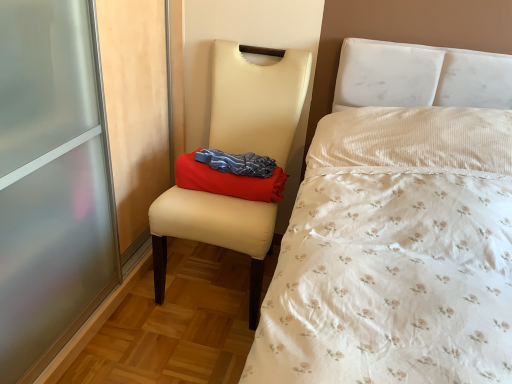
Find the location of a particular element. red fabric pillow at center is located at coordinates (231, 175).

This screenshot has height=384, width=512. What do you see at coordinates (231, 175) in the screenshot?
I see `red fabric pillow at center` at bounding box center [231, 175].

Describe the element at coordinates (256, 101) in the screenshot. I see `matte cream chair at center` at that location.

What are the coordinates of `matte cream chair at center` in the screenshot? It's located at (256, 101).

The height and width of the screenshot is (384, 512). Find the location of `red fabric pillow at center`. red fabric pillow at center is located at coordinates (231, 175).

Would you say red fabric pillow at center is to the left or to the right of matte cream chair at center in the picture?

Based on their positions, red fabric pillow at center is located to the right of matte cream chair at center.

From the picture: Which object is closer to the camera taking this photo, red fabric pillow at center or matte cream chair at center?

matte cream chair at center is in front.

Is point (193, 169) closer to viewer compared to point (212, 120)?

That is True.

From the image's perspective, is red fabric pillow at center positioned above or below matte cream chair at center?

Based on their image positions, red fabric pillow at center is located above matte cream chair at center.

From a real-world perspective, which is physically below, red fabric pillow at center or matte cream chair at center?

matte cream chair at center is physically lower.

Considering the relative sizes of red fabric pillow at center and matte cream chair at center in the image provided, is red fabric pillow at center thinner than matte cream chair at center?

Yes, red fabric pillow at center is thinner than matte cream chair at center.

In the scene shown: Between red fabric pillow at center and matte cream chair at center, which one has more height?

Standing taller between the two is matte cream chair at center.

Who is bigger, red fabric pillow at center or matte cream chair at center?

Bigger between the two is matte cream chair at center.

Is red fabric pillow at center not within matte cream chair at center?

No, red fabric pillow at center is inside matte cream chair at center's boundary.

Is red fabric pillow at center far away from matte cream chair at center?

red fabric pillow at center is actually quite close to matte cream chair at center.

Is red fabric pillow at center aimed at matte cream chair at center?

Yes, red fabric pillow at center is facing matte cream chair at center.

Identify the location of pillow on the right of matte cream chair at center. This screenshot has width=512, height=384. (231, 175).

Does matte cream chair at center appear on the right side of red fabric pillow at center?

Incorrect, matte cream chair at center is not on the right side of red fabric pillow at center.

Is the depth of matte cream chair at center greater than that of red fabric pillow at center?

No, it is not.

Is point (237, 46) behind point (254, 168)?

Yes, point (237, 46) is farther from viewer.

In the scene shown: From the image's perspective, is matte cream chair at center over red fabric pillow at center?

Actually, matte cream chair at center appears below red fabric pillow at center in the image.

From a real-world perspective, between matte cream chair at center and red fabric pillow at center, who is vertically higher?

In real-world perspective, red fabric pillow at center is above.

Which object is thinner, matte cream chair at center or red fabric pillow at center?

red fabric pillow at center is thinner.

Is matte cream chair at center taller or shorter than red fabric pillow at center?

Clearly, matte cream chair at center is taller compared to red fabric pillow at center.

Based on the photo, looking at the image, does matte cream chair at center seem bigger or smaller compared to red fabric pillow at center?

In the image, matte cream chair at center appears to be larger than red fabric pillow at center.

Is matte cream chair at center surrounding red fabric pillow at center?

Yes.

Can you see matte cream chair at center touching red fabric pillow at center?

No, matte cream chair at center is not with red fabric pillow at center.

Could you tell me if matte cream chair at center is turned towards red fabric pillow at center?

Yes, matte cream chair at center is aimed at red fabric pillow at center.

The image size is (512, 384). In order to click on pillow that appears on the right of matte cream chair at center in this screenshot , I will do `click(231, 175)`.

At what (x,y) coordinates should I click in order to perform the action: click on pillow above the matte cream chair at center (from a real-world perspective). Please return your answer as a coordinate pair (x, y). The image size is (512, 384). Looking at the image, I should click on (231, 175).

Where is `pillow on the right of the matte cream chair at center`? pillow on the right of the matte cream chair at center is located at coordinates (231, 175).